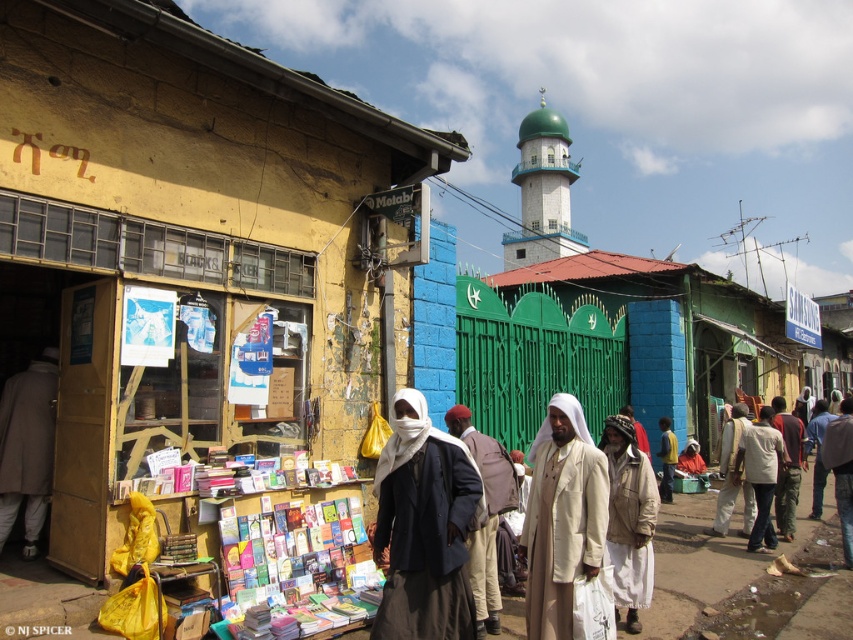
Can you confirm if gray woolen coat at left is positioned above white fabric headscarf at center?

Yes.

Does point (0, 444) come closer to viewer compared to point (451, 429)?

No.

The image size is (853, 640). Find the location of `gray woolen coat at left`. gray woolen coat at left is located at coordinates (27, 445).

Between white matte headscarf at center and light brown fabric jacket at center, which one has less height?

white matte headscarf at center

Which is more to the left, white matte headscarf at center or light brown fabric jacket at center?

white matte headscarf at center is more to the left.

This screenshot has height=640, width=853. I want to click on white matte headscarf at center, so click(x=422, y=529).

From the picture: Is white fabric headscarf at center below light beige fabric headscarf at center?

Actually, white fabric headscarf at center is above light beige fabric headscarf at center.

How distant is white fabric headscarf at center from light beige fabric headscarf at center?

white fabric headscarf at center is 7.69 meters from light beige fabric headscarf at center.

Is point (486, 541) behind point (664, 468)?

No, (486, 541) is in front of (664, 468).

Where is `white fabric headscarf at center`? white fabric headscarf at center is located at coordinates (486, 515).